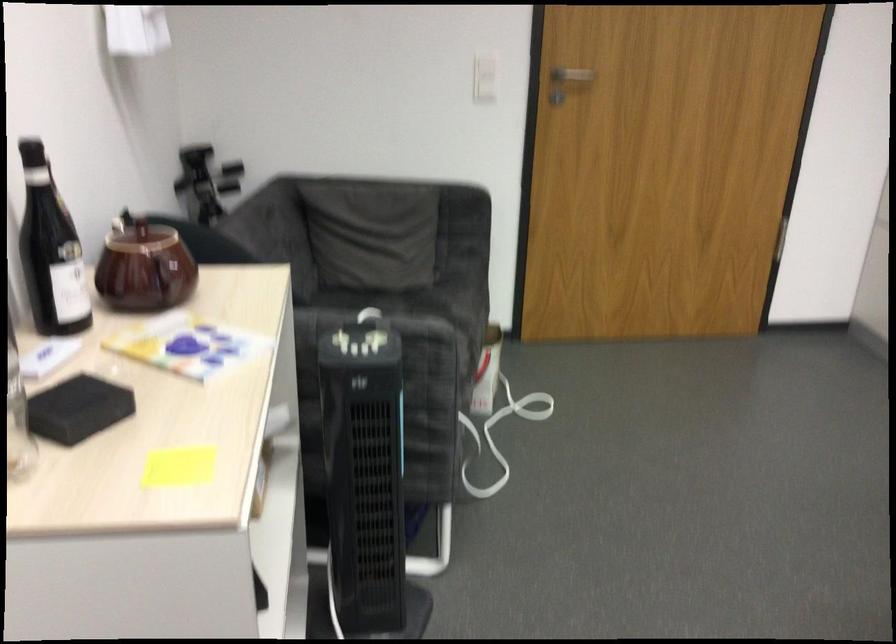
Find the location of a particular element. This screenshot has height=644, width=896. chair armrest is located at coordinates (388, 176).